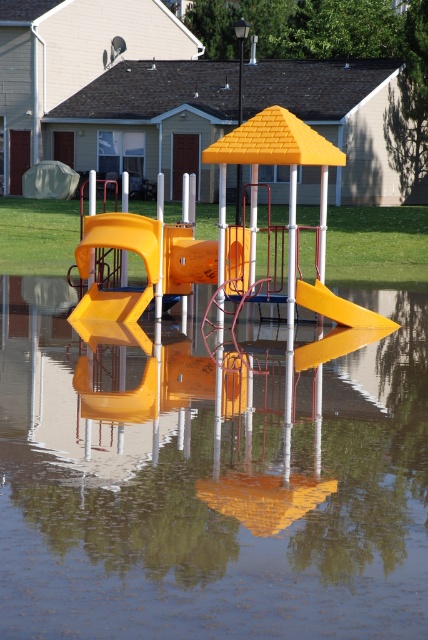
Question: Can you confirm if transparent plastic water at center is bigger than yellow matte slide at center?

Choices:
 (A) no
 (B) yes

Answer: (B)

Question: Which point is closer to the camera?

Choices:
 (A) transparent plastic water at center
 (B) yellow matte slide at center

Answer: (A)

Question: Which object is farther from the camera taking this photo?

Choices:
 (A) yellow matte slide at center
 (B) transparent plastic water at center

Answer: (A)

Question: Can you confirm if transparent plastic water at center is smaller than yellow matte slide at center?

Choices:
 (A) no
 (B) yes

Answer: (A)

Question: Does transparent plastic water at center appear on the right side of yellow matte slide at center?

Choices:
 (A) no
 (B) yes

Answer: (A)